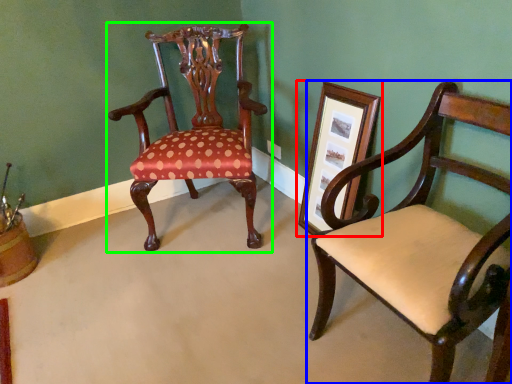
Question: Which is farther away from picture frame (highlighted by a red box)? chair (highlighted by a blue box) or chair (highlighted by a green box)?

Choices:
 (A) chair
 (B) chair

Answer: (B)